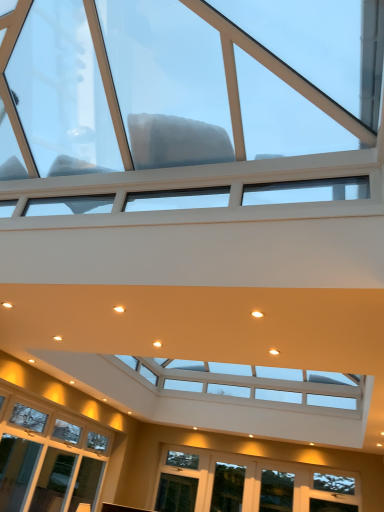
Where is `clear glass window at lower center, which appears as the 3th window when viewed from the top`? The width and height of the screenshot is (384, 512). clear glass window at lower center, which appears as the 3th window when viewed from the top is located at coordinates (228, 488).

Can clear glass window at lower center, which ranks as the third window in front-to-back order, be found inside clear glass window at lower center, which appears as the second window when viewed from the top?

That's incorrect, clear glass window at lower center, which ranks as the third window in front-to-back order, is not inside clear glass window at lower center, which appears as the second window when viewed from the top.

Is clear glass window at lower center, the second window in the front-to-back sequence, closer to the viewer compared to clear glass window at lower center, which ranks as the third window in front-to-back order?

Yes, clear glass window at lower center, the second window in the front-to-back sequence, is closer to the camera.

Can you confirm if clear glass window at lower center, which appears as the 2th window when ordered from the bottom, is shorter than clear glass window at lower center, arranged as the 1th window when viewed from the back?

Indeed, clear glass window at lower center, which appears as the 2th window when ordered from the bottom, has a lesser height compared to clear glass window at lower center, arranged as the 1th window when viewed from the back.

Considering the positions of objects clear glass window at lower center, the second window when ordered from back to front, and clear glass window at lower center, arranged as the 1th window when viewed from the back, in the image provided, who is more to the right, clear glass window at lower center, the second window when ordered from back to front, or clear glass window at lower center, arranged as the 1th window when viewed from the back,?

From the viewer's perspective, clear glass window at lower center, the second window when ordered from back to front, appears more on the right side.

Does transparent glass window at upper center, which is counted as the 1th window, starting from the top, have a larger size compared to clear glass window at lower center, acting as the first window starting from the bottom?

Yes.

Could clear glass window at lower center, acting as the first window starting from the bottom, be considered to be inside transparent glass window at upper center, marked as the 1th window in a front-to-back arrangement?

No.

Considering the relative sizes of transparent glass window at upper center, marked as the 1th window in a front-to-back arrangement, and clear glass window at lower center, which appears as the 3th window when viewed from the top, in the image provided, is transparent glass window at upper center, marked as the 1th window in a front-to-back arrangement, wider than clear glass window at lower center, which appears as the 3th window when viewed from the top,?

Yes.

Starting from the transparent glass window at upper center, the third window from the back, which window is the 1st one behind? Please provide its 2D coordinates.

[(276, 490)]

Which is in front, point (270, 26) or point (264, 502)?

The point (270, 26) is more forward.

Can you confirm if transparent glass window at upper center, marked as the 1th window in a front-to-back arrangement, is wider than clear glass window at lower center, the second window in the front-to-back sequence?

Indeed, transparent glass window at upper center, marked as the 1th window in a front-to-back arrangement, has a greater width compared to clear glass window at lower center, the second window in the front-to-back sequence.

How many degrees apart are the facing directions of clear glass window at lower center, which appears as the 3th window when viewed from the top, and transparent glass window at upper center, which is counted as the 1th window, starting from the top?

The facing directions of clear glass window at lower center, which appears as the 3th window when viewed from the top, and transparent glass window at upper center, which is counted as the 1th window, starting from the top, are 90.7 degrees apart.

In the scene shown: Is clear glass window at lower center, which ranks as the third window in front-to-back order, not close to transparent glass window at upper center, the third window from the back?

Yes, clear glass window at lower center, which ranks as the third window in front-to-back order, and transparent glass window at upper center, the third window from the back, are located far from each other.

The image size is (384, 512). Find the location of `window on the left side of clear glass window at lower center, which appears as the 3th window when viewed from the top`. window on the left side of clear glass window at lower center, which appears as the 3th window when viewed from the top is located at coordinates (177, 95).

Considering the sizes of clear glass window at lower center, which appears as the 3th window when viewed from the top, and transparent glass window at upper center, which is counted as the third window, starting from the bottom, in the image, is clear glass window at lower center, which appears as the 3th window when viewed from the top, bigger or smaller than transparent glass window at upper center, which is counted as the third window, starting from the bottom,?

clear glass window at lower center, which appears as the 3th window when viewed from the top, is smaller than transparent glass window at upper center, which is counted as the third window, starting from the bottom.

What's the angular difference between clear glass window at lower center, which appears as the second window when viewed from the top, and transparent glass window at upper center, which is counted as the 1th window, starting from the top,'s facing directions?

90.7 degrees.

From a real-world perspective, is clear glass window at lower center, the second window in the front-to-back sequence, under transparent glass window at upper center, which is counted as the third window, starting from the bottom?

Indeed, from a real-world perspective, clear glass window at lower center, the second window in the front-to-back sequence, is positioned beneath transparent glass window at upper center, which is counted as the third window, starting from the bottom.

Would you say transparent glass window at upper center, marked as the 1th window in a front-to-back arrangement, is part of clear glass window at lower center, the second window when ordered from back to front,'s contents?

No.

Would you say clear glass window at lower center, the second window in the front-to-back sequence, is to the left or to the right of transparent glass window at upper center, the third window from the back, in the picture?

In the image, clear glass window at lower center, the second window in the front-to-back sequence, appears on the right side of transparent glass window at upper center, the third window from the back.

From the image's perspective, which is below, clear glass window at lower center, acting as the first window starting from the bottom, or clear glass window at lower center, the second window when ordered from back to front?

From the image's view, clear glass window at lower center, acting as the first window starting from the bottom, is below.

Is clear glass window at lower center, which appears as the 3th window when viewed from the top, oriented towards clear glass window at lower center, the second window when ordered from back to front?

No, clear glass window at lower center, which appears as the 3th window when viewed from the top, is not facing towards clear glass window at lower center, the second window when ordered from back to front.

What's the angular difference between clear glass window at lower center, arranged as the 1th window when viewed from the back, and clear glass window at lower center, which appears as the second window when viewed from the top,'s facing directions?

The facing directions of clear glass window at lower center, arranged as the 1th window when viewed from the back, and clear glass window at lower center, which appears as the second window when viewed from the top, are 0.000201 degrees apart.

Does clear glass window at lower center, acting as the first window starting from the bottom, appear on the right side of clear glass window at lower center, which appears as the 2th window when ordered from the bottom?

No, clear glass window at lower center, acting as the first window starting from the bottom, is not to the right of clear glass window at lower center, which appears as the 2th window when ordered from the bottom.

The height and width of the screenshot is (512, 384). In order to click on window that is the 1st one when counting forward from the clear glass window at lower center, which appears as the 3th window when viewed from the top in this screenshot , I will do `click(276, 490)`.

From the transparent glass window at upper center, which is counted as the 1th window, starting from the top, count 1st window to the right and point to it. Please provide its 2D coordinates.

[(228, 488)]

Considering their positions, is clear glass window at lower center, acting as the first window starting from the bottom, positioned closer to transparent glass window at upper center, which is counted as the 1th window, starting from the top, than clear glass window at lower center, which appears as the 2th window when ordered from the bottom?

Among the two, clear glass window at lower center, which appears as the 2th window when ordered from the bottom, is located nearer to transparent glass window at upper center, which is counted as the 1th window, starting from the top.

From the image, which object appears to be farther from clear glass window at lower center, the second window when ordered from back to front, transparent glass window at upper center, which is counted as the 1th window, starting from the top, or clear glass window at lower center, which appears as the 3th window when viewed from the top?

transparent glass window at upper center, which is counted as the 1th window, starting from the top, is further to clear glass window at lower center, the second window when ordered from back to front.

Considering their positions, is transparent glass window at upper center, which is counted as the 1th window, starting from the top, positioned closer to clear glass window at lower center, which appears as the 3th window when viewed from the top, than clear glass window at lower center, which appears as the second window when viewed from the top?

clear glass window at lower center, which appears as the second window when viewed from the top, lies closer to clear glass window at lower center, which appears as the 3th window when viewed from the top, than the other object.

Looking at the image, which one is located closer to clear glass window at lower center, which appears as the 3th window when viewed from the top, clear glass window at lower center, the second window when ordered from back to front, or transparent glass window at upper center, marked as the 1th window in a front-to-back arrangement?

clear glass window at lower center, the second window when ordered from back to front.

Considering their positions, is clear glass window at lower center, which appears as the second window when viewed from the top, positioned further to transparent glass window at upper center, which is counted as the 1th window, starting from the top, than clear glass window at lower center, arranged as the 1th window when viewed from the back?

clear glass window at lower center, arranged as the 1th window when viewed from the back, is positioned further to the anchor transparent glass window at upper center, which is counted as the 1th window, starting from the top.

When comparing their distances from clear glass window at lower center, the second window in the front-to-back sequence, does clear glass window at lower center, which appears as the 3th window when viewed from the top, or transparent glass window at upper center, which is counted as the 1th window, starting from the top, seem closer?

clear glass window at lower center, which appears as the 3th window when viewed from the top.

You are a GUI agent. You are given a task and a screenshot of the screen. Output one action in this format:
    pyautogui.click(x=<x>, y=<y>)
    Task: Click on the window between transparent glass window at upper center, the third window from the back, and clear glass window at lower center, which appears as the 3th window when viewed from the top, along the z-axis
    Image resolution: width=384 pixels, height=512 pixels.
    Given the screenshot: What is the action you would take?
    pyautogui.click(x=276, y=490)